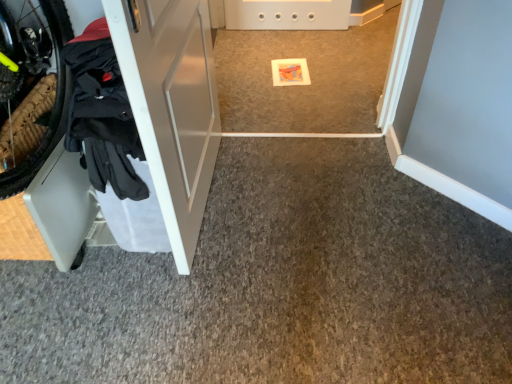
Where is `white glossy door at left`? The width and height of the screenshot is (512, 384). white glossy door at left is located at coordinates (170, 105).

The image size is (512, 384). What do you see at coordinates (170, 105) in the screenshot?
I see `white glossy door at left` at bounding box center [170, 105].

At what (x,y) coordinates should I click in order to perform the action: click on white glossy door at left. Please return your answer as a coordinate pair (x, y). Looking at the image, I should click on (170, 105).